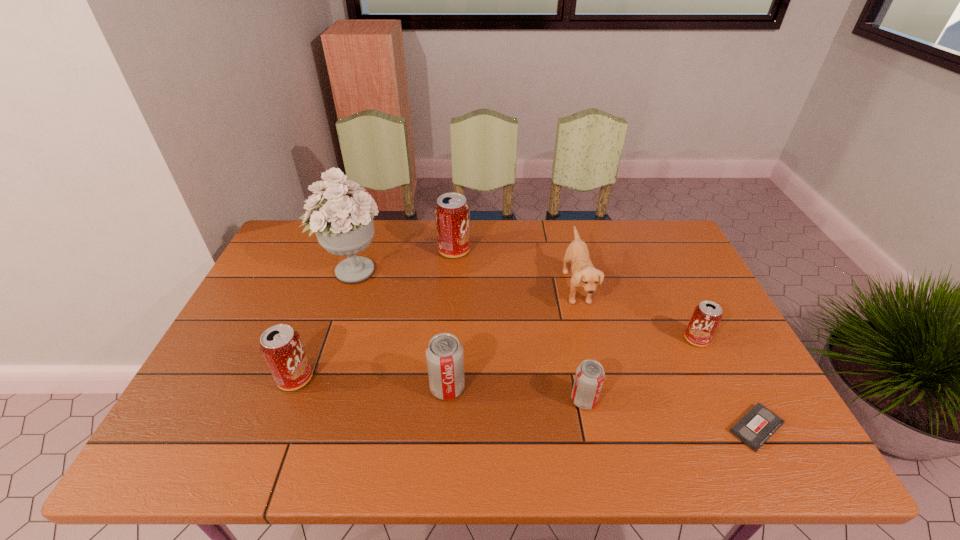
Find the location of a particular element. This screenshot has height=540, width=960. the fourth soda can from left to right is located at coordinates (589, 378).

The height and width of the screenshot is (540, 960). In order to click on the smaller gray soda can in this screenshot , I will do `click(589, 378)`.

Locate an element on the screen. Image resolution: width=960 pixels, height=540 pixels. videotape is located at coordinates (759, 423).

Find the location of `vacant space situated on the right of the bouquet`. vacant space situated on the right of the bouquet is located at coordinates (505, 271).

Identify the location of free location located on the left of the biggest red soda can. This screenshot has height=540, width=960. (387, 251).

You are a GUI agent. You are given a task and a screenshot of the screen. Output one action in this format:
    pyautogui.click(x=<x>, y=<y>)
    Task: Click on the free space located on the left side of the puppy
    
    Given the screenshot: What is the action you would take?
    pyautogui.click(x=484, y=287)

At what (x,y) coordinates should I click in order to perform the action: click on vacant area situated on the left side of the puppy. Please return your answer as a coordinate pair (x, y). Looking at the image, I should click on (527, 287).

Find the location of `vacant point located 0.250m on the left side of the puppy`. vacant point located 0.250m on the left side of the puppy is located at coordinates (481, 287).

Locate an element on the screen. This screenshot has height=540, width=960. vacant space located on the back of the bigger gray soda can is located at coordinates (453, 300).

Locate an element on the screen. The height and width of the screenshot is (540, 960). free region located 0.160m on the back of the nearest red soda can is located at coordinates (318, 318).